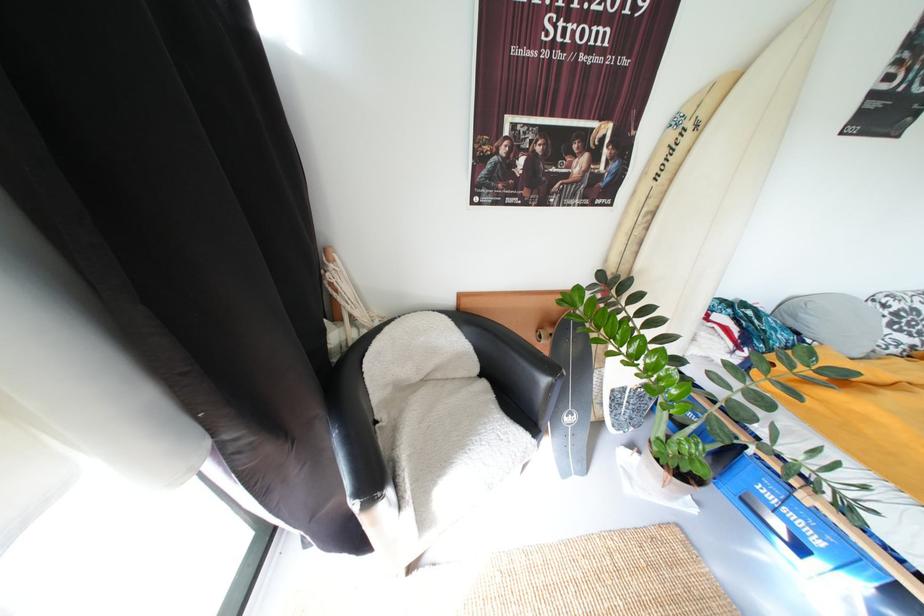
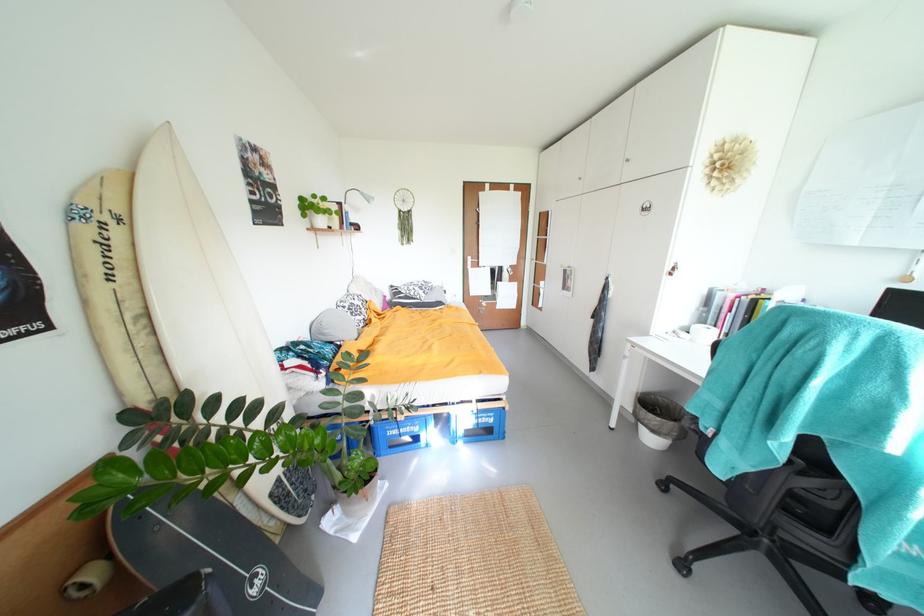
Find the pixel in the second image that matches (x=809, y=317) in the first image.

(333, 333)